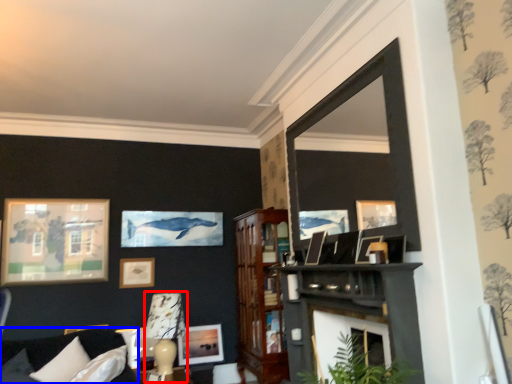
Question: Among these objects, which one is nearest to the camera, lamp (highlighted by a red box) or couch (highlighted by a blue box)?

Choices:
 (A) lamp
 (B) couch

Answer: (B)